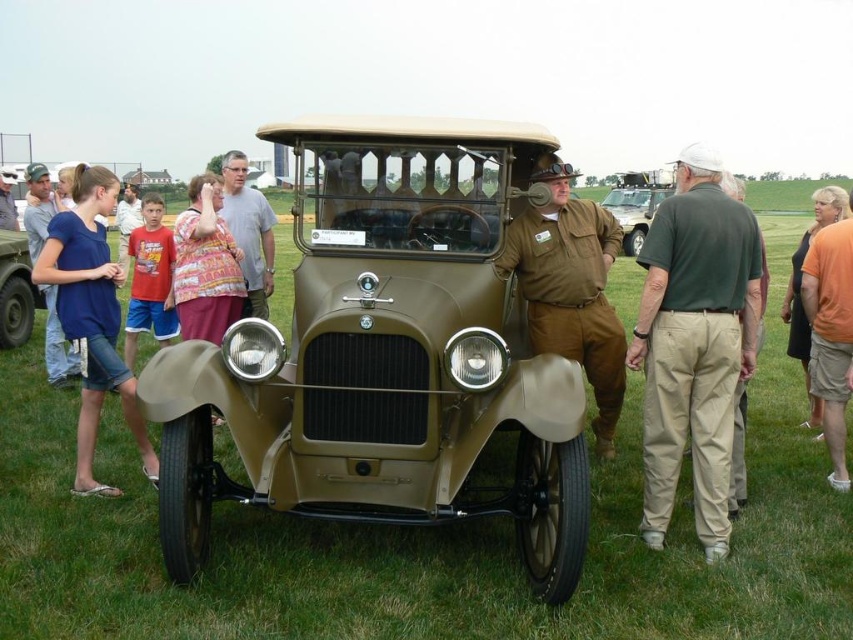
Question: From the image, what is the correct spatial relationship of matte olive-green car at center in relation to blue denim shorts at lower left?

Choices:
 (A) above
 (B) below

Answer: (A)

Question: Among these objects, which one is farthest from the camera?

Choices:
 (A) matte olive green car at center
 (B) khaki cotton pants at center
 (C) green grass at center
 (D) gray cotton shirt at center

Answer: (D)

Question: Which object is positioned farthest from the green grass at center?

Choices:
 (A) brown uniform at front
 (B) matte olive-green car at center

Answer: (A)

Question: Does gray cotton shirt at center have a lesser width compared to matte khaki pants at left?

Choices:
 (A) no
 (B) yes

Answer: (B)

Question: Can you confirm if green grass at center is positioned to the left of blue denim shorts at lower left?

Choices:
 (A) yes
 (B) no

Answer: (B)

Question: Which of the following is the closest to the observer?

Choices:
 (A) (598, 241)
 (B) (10, 202)
 (C) (44, 195)

Answer: (A)